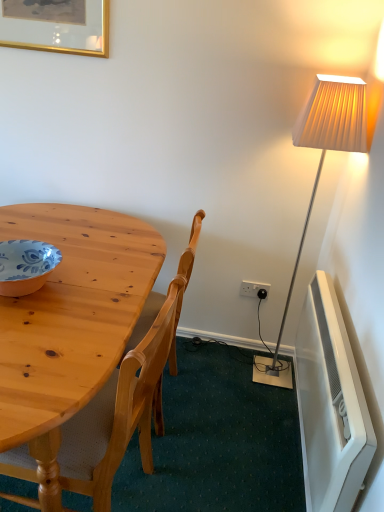
Question: Would you say white plastic radiator at lower right contains matte orange bowl at left?

Choices:
 (A) no
 (B) yes

Answer: (A)

Question: Considering the relative sizes of white plastic radiator at lower right and matte orange bowl at left in the image provided, is white plastic radiator at lower right taller than matte orange bowl at left?

Choices:
 (A) no
 (B) yes

Answer: (B)

Question: Is white plastic radiator at lower right smaller than matte orange bowl at left?

Choices:
 (A) yes
 (B) no

Answer: (B)

Question: From the image's perspective, is white plastic radiator at lower right on top of matte orange bowl at left?

Choices:
 (A) yes
 (B) no

Answer: (B)

Question: Are white plastic radiator at lower right and matte orange bowl at left located far from each other?

Choices:
 (A) no
 (B) yes

Answer: (B)

Question: Considering the relative positions of white plastic radiator at lower right and matte orange bowl at left in the image provided, is white plastic radiator at lower right in front of matte orange bowl at left?

Choices:
 (A) no
 (B) yes

Answer: (B)

Question: Does white plastic radiator at lower right have a lesser height compared to white plastic power outlet at lower right?

Choices:
 (A) yes
 (B) no

Answer: (B)

Question: Is white plastic radiator at lower right further to the viewer compared to white plastic power outlet at lower right?

Choices:
 (A) no
 (B) yes

Answer: (A)

Question: Is white plastic radiator at lower right facing away from white plastic power outlet at lower right?

Choices:
 (A) yes
 (B) no

Answer: (B)

Question: Is there a large distance between white plastic radiator at lower right and white plastic power outlet at lower right?

Choices:
 (A) no
 (B) yes

Answer: (A)

Question: Considering the relative sizes of white plastic radiator at lower right and white plastic power outlet at lower right in the image provided, is white plastic radiator at lower right smaller than white plastic power outlet at lower right?

Choices:
 (A) yes
 (B) no

Answer: (B)

Question: Is white plastic radiator at lower right oriented towards white plastic power outlet at lower right?

Choices:
 (A) yes
 (B) no

Answer: (B)

Question: Is gold-framed picture at upper left in front of natural wood chair at left?

Choices:
 (A) yes
 (B) no

Answer: (B)